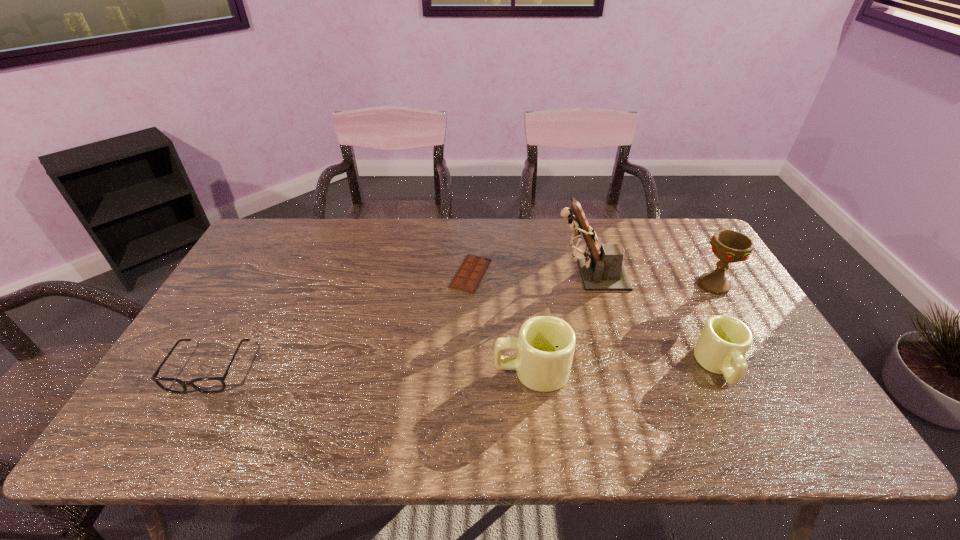
Locate which object is the fifth closest to the shortest object. Please provide its 2D coordinates. Your answer should be formatted as a tuple, i.e. [(x, y)], where the tuple contains the x and y coordinates of a point satisfying the conditions above.

[(729, 246)]

In order to click on vacant region that satisfies the following two spatial constraints: 1. with the handle on the side of the fourth tallest object; 2. with the handle on the side of the left mug in this screenshot , I will do `click(721, 371)`.

Image resolution: width=960 pixels, height=540 pixels. I want to click on vacant region that satisfies the following two spatial constraints: 1. with the handle on the side of the shorter mug; 2. with the handle on the side of the left mug, so click(721, 371).

The width and height of the screenshot is (960, 540). In order to click on free location that satisfies the following two spatial constraints: 1. on the front-facing side of the third object from right to left; 2. on the front-facing side of the second shortest object in this screenshot , I will do `click(616, 369)`.

I want to click on blank space that satisfies the following two spatial constraints: 1. on the front-facing side of the rightmost object; 2. on the left side of the tallest object, so click(x=592, y=285).